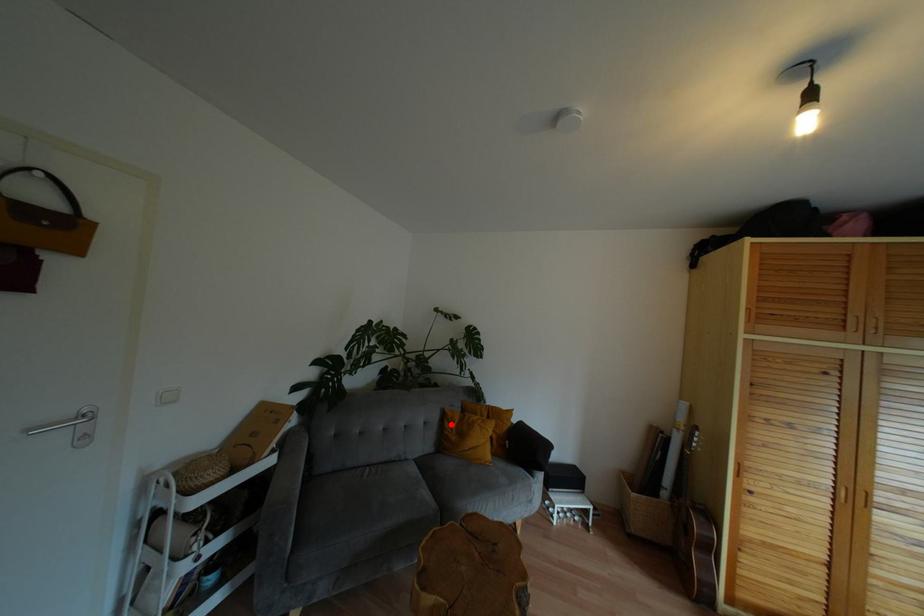
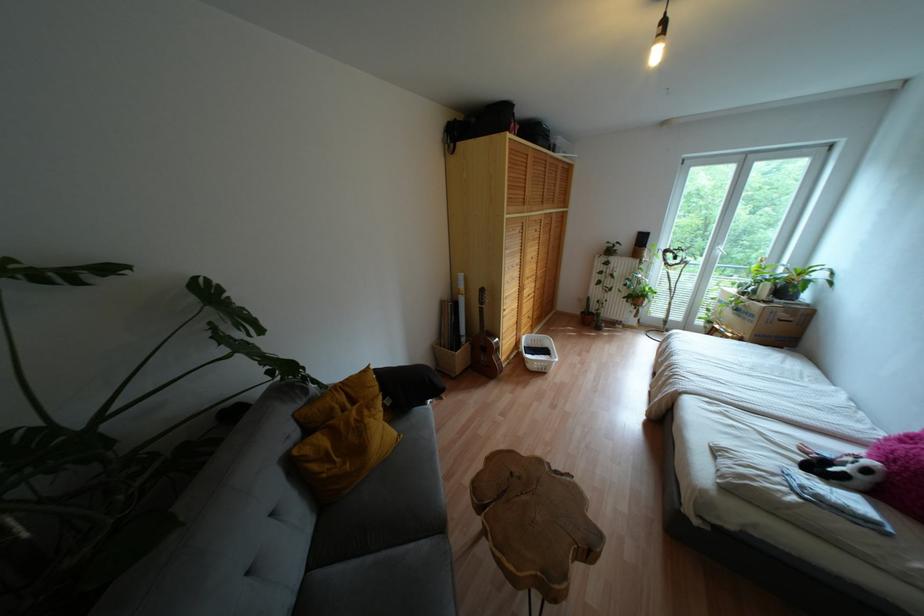
In the second image, find the point that corresponds to the highlighted location in the first image.

(325, 458)